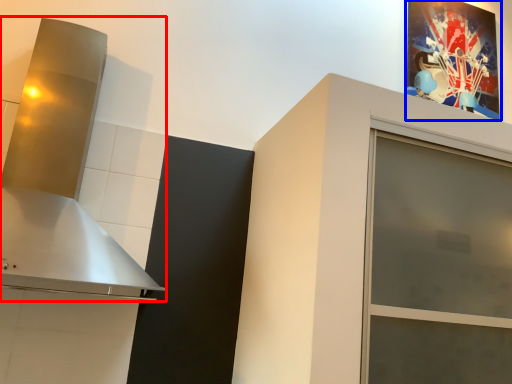
Question: Among these objects, which one is nearest to the camera, vent (highlighted by a red box) or picture frame (highlighted by a blue box)?

Choices:
 (A) vent
 (B) picture frame

Answer: (A)